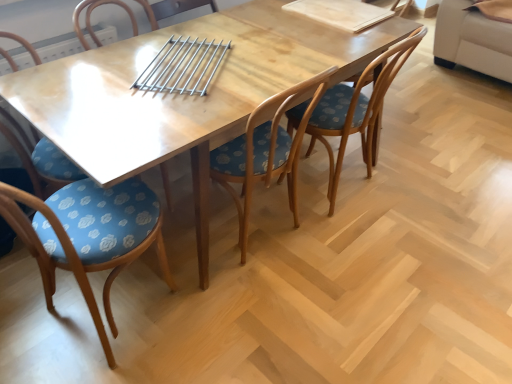
This screenshot has width=512, height=384. I want to click on free location in front of wooden chair with floral cushion at center, positioned as the fourth chair in left-to-right order, so click(369, 253).